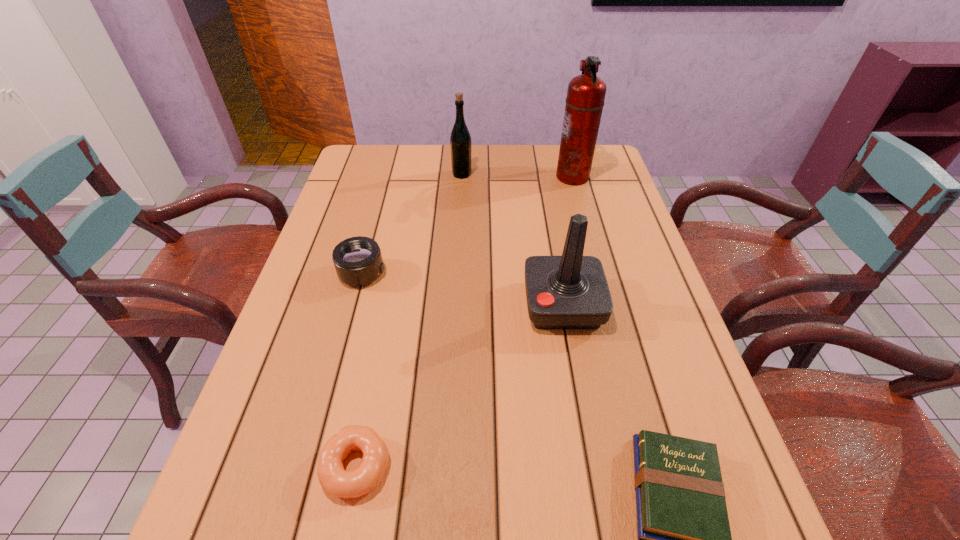
Where is `free location that satisfies the following two spatial constraints: 1. on the side of the telephoto lens with brand markings and control switches; 2. on the left side of the doughnut`? free location that satisfies the following two spatial constraints: 1. on the side of the telephoto lens with brand markings and control switches; 2. on the left side of the doughnut is located at coordinates (310, 467).